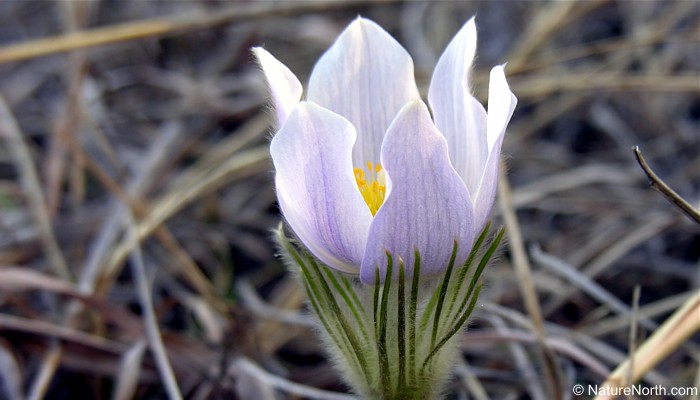
The image size is (700, 400). In order to click on picture in this screenshot , I will do pyautogui.click(x=368, y=247).